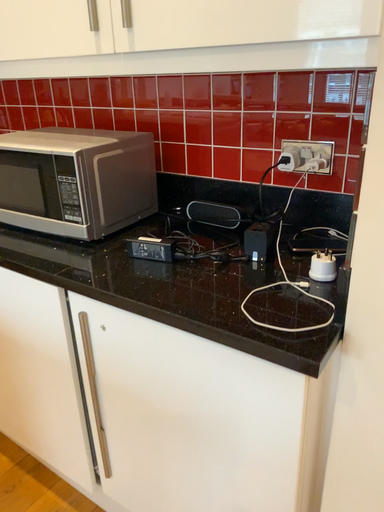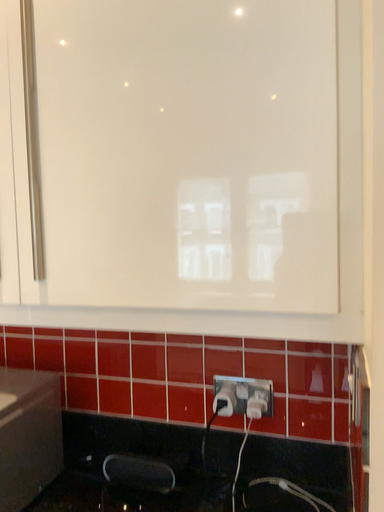
Question: Which way did the camera rotate in the video?

Choices:
 (A) rotated downward
 (B) rotated upward

Answer: (B)